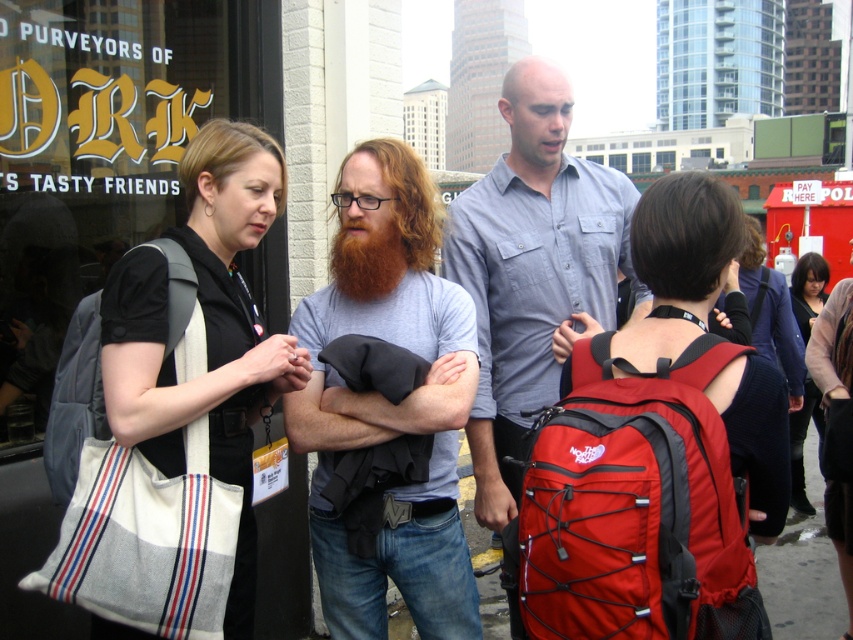
You are organizing a backpacking trip and need to choose between the red fabric backpack at right and the white canvas bag at left. Based on their sizes, which one would be better for carrying more gear?

The white canvas bag at left is taller than the red fabric backpack at right, so it can carry more gear.